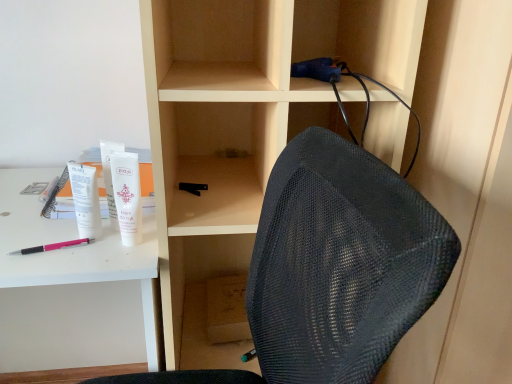
Question: From the image's perspective, is white matte tube at upper left over white matte tube at upper left, the second stationery positioned from the top?

Choices:
 (A) yes
 (B) no

Answer: (B)

Question: Can you confirm if white matte tube at upper left is bigger than white matte tube at upper left, which is the second stationery in left-to-right order?

Choices:
 (A) yes
 (B) no

Answer: (A)

Question: Considering the relative sizes of white matte tube at upper left and white matte tube at upper left, which is the second stationery in left-to-right order, in the image provided, is white matte tube at upper left taller than white matte tube at upper left, which is the second stationery in left-to-right order,?

Choices:
 (A) no
 (B) yes

Answer: (A)

Question: Is white matte tube at upper left located outside white matte tube at upper left, which is the second stationery in left-to-right order?

Choices:
 (A) yes
 (B) no

Answer: (A)

Question: Is white matte tube at upper left closer to the viewer compared to white matte tube at upper left, the second stationery positioned from the top?

Choices:
 (A) no
 (B) yes

Answer: (B)

Question: Considering the relative positions of blue fabric cable at upper center, the 4th stationery when ordered from bottom to top, and white plastic desk at upper left in the image provided, is blue fabric cable at upper center, the 4th stationery when ordered from bottom to top, to the left or to the right of white plastic desk at upper left?

Choices:
 (A) left
 (B) right

Answer: (B)

Question: Relative to white plastic desk at upper left, is blue fabric cable at upper center, acting as the 4th stationery starting from the left, in front or behind?

Choices:
 (A) front
 (B) behind

Answer: (B)

Question: Is point (290, 66) positioned closer to the camera than point (116, 243)?

Choices:
 (A) farther
 (B) closer

Answer: (A)

Question: From the image's perspective, is blue fabric cable at upper center, arranged as the first stationery when viewed from the top, positioned above or below white plastic desk at upper left?

Choices:
 (A) above
 (B) below

Answer: (A)

Question: Is white matte tube at upper left, marked as the 4th stationery in a top-to-bottom arrangement, in front of or behind white matte tube at upper left in the image?

Choices:
 (A) behind
 (B) front

Answer: (A)

Question: From a real-world perspective, is white matte tube at upper left, marked as the 4th stationery in a top-to-bottom arrangement, positioned above or below white matte tube at upper left?

Choices:
 (A) above
 (B) below

Answer: (B)

Question: Considering the positions of point (89, 213) and point (132, 153), is point (89, 213) closer or farther from the camera than point (132, 153)?

Choices:
 (A) closer
 (B) farther

Answer: (B)

Question: Visually, is white matte tube at upper left, marked as the 4th stationery in a top-to-bottom arrangement, positioned to the left or to the right of white matte tube at upper left?

Choices:
 (A) left
 (B) right

Answer: (A)

Question: Considering the positions of point (324, 79) and point (10, 253), is point (324, 79) closer or farther from the camera than point (10, 253)?

Choices:
 (A) farther
 (B) closer

Answer: (B)

Question: Considering the positions of blue fabric cable at upper center, arranged as the first stationery when viewed from the top, and pink plastic pen at lower left in the image, is blue fabric cable at upper center, arranged as the first stationery when viewed from the top, bigger or smaller than pink plastic pen at lower left?

Choices:
 (A) big
 (B) small

Answer: (A)